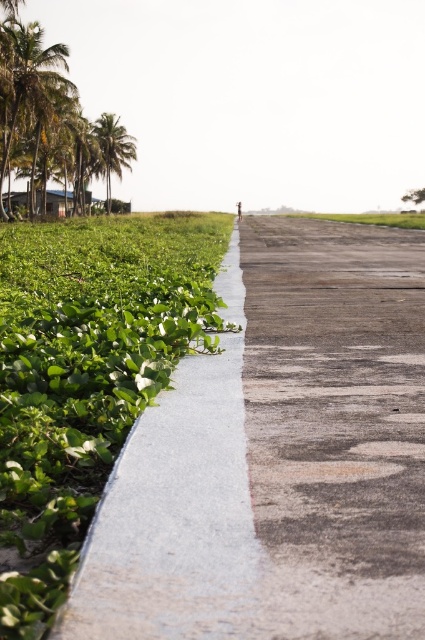
You are a hiker planning to walk along the white smooth pavement at center and the green leafy palm trees at upper left. Which area would you have more space to walk in?

The green leafy palm trees at upper left occupy more space than the white smooth pavement at center, so you would have more space to walk in the area of the green leafy palm trees at upper left.